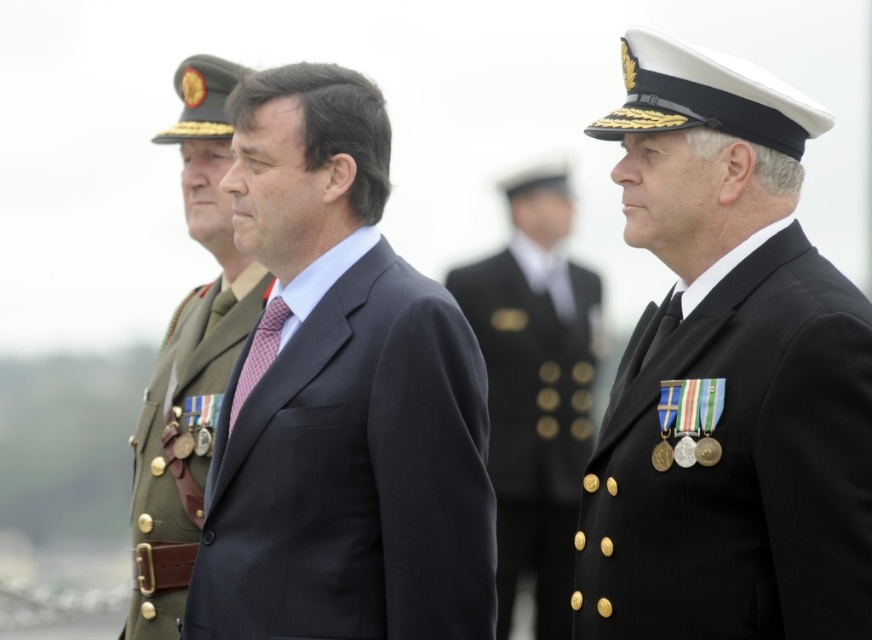
Consider the image. Which is more to the left, black woolen suit at center or shiny gold buttons at center?

shiny gold buttons at center

Can you confirm if black woolen suit at center is positioned to the left of shiny gold buttons at center?

In fact, black woolen suit at center is to the right of shiny gold buttons at center.

Measure the distance between point (x=632, y=362) and camera.

A distance of 11.19 meters exists between point (x=632, y=362) and camera.

This screenshot has width=872, height=640. In order to click on black woolen suit at center in this screenshot , I will do `click(727, 378)`.

Which is above, matte black suit at center or green military uniform at left?

green military uniform at left is above.

Between matte black suit at center and green military uniform at left, which one has more height?

green military uniform at left is taller.

Who is more distant from viewer, (362, 552) or (155, 595)?

The point (155, 595) is more distant.

In order to click on matte black suit at center in this screenshot , I will do `click(339, 397)`.

Consider the image. Does black woolen suit at center have a lesser width compared to matte black suit at center?

Yes.

Which is below, black woolen suit at center or matte black suit at center?

matte black suit at center is lower down.

Locate an element on the screen. black woolen suit at center is located at coordinates (727, 378).